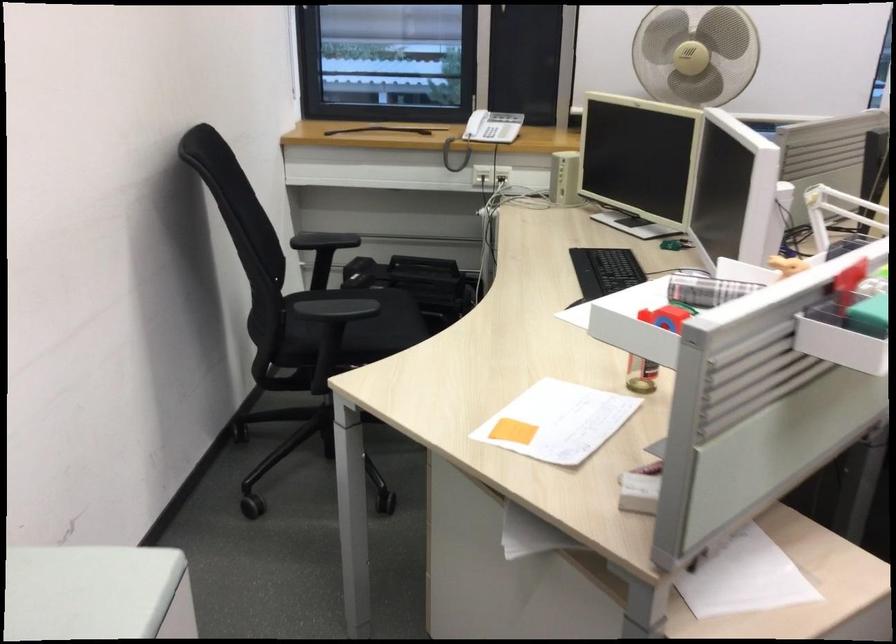
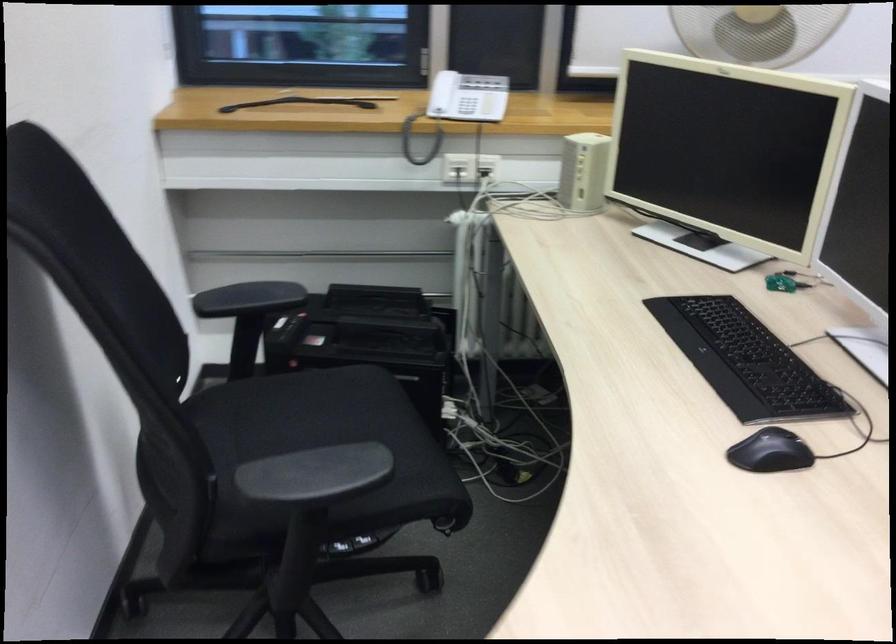
Where in the second image is the point corresponding to point (330, 313) from the first image?

(315, 475)